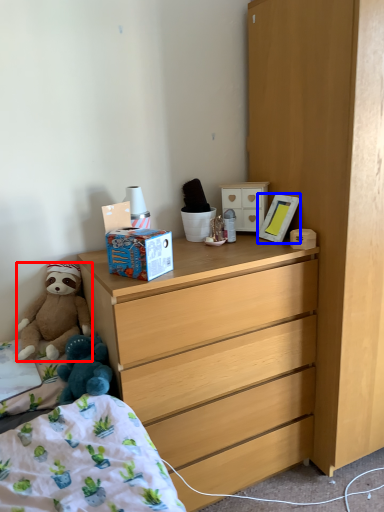
Question: Which of the following is the farthest to the observer, teddy bear (highlighted by a red box) or picture frame (highlighted by a blue box)?

Choices:
 (A) teddy bear
 (B) picture frame

Answer: (B)